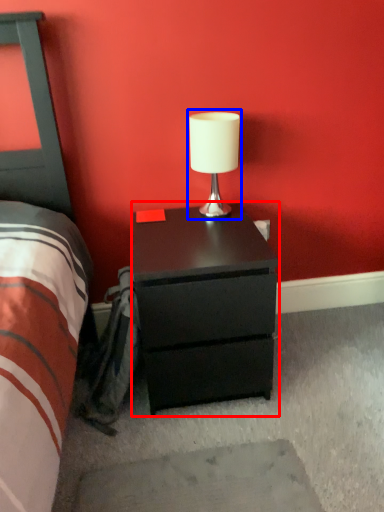
Question: Which point is closer to the camera, nightstand (highlighted by a red box) or table lamp (highlighted by a blue box)?

Choices:
 (A) nightstand
 (B) table lamp

Answer: (A)